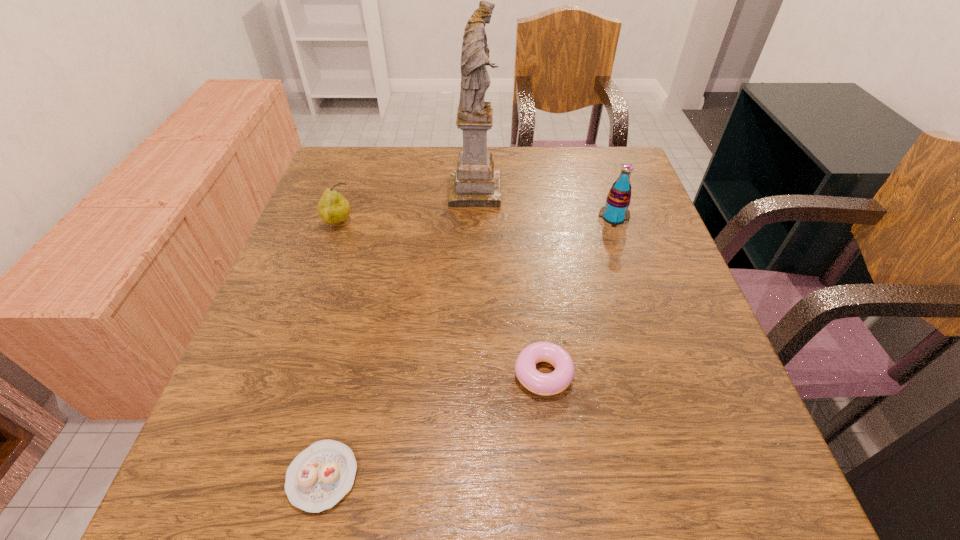
Locate an element on the screen. The height and width of the screenshot is (540, 960). object that is positioned at the near left corner is located at coordinates (320, 476).

This screenshot has width=960, height=540. In the image, there is a desktop. Identify the location of vacant space at the far edge. (396, 173).

What are the coordinates of `vacant region at the near edge of the desktop` in the screenshot? It's located at (464, 484).

I want to click on blank area at the left edge, so click(333, 321).

The height and width of the screenshot is (540, 960). I want to click on vacant region at the right edge of the desktop, so click(x=664, y=306).

You are a GUI agent. You are given a task and a screenshot of the screen. Output one action in this format:
    pyautogui.click(x=<x>, y=<y>)
    Task: Click on the vacant space at the far right corner of the desktop
    This screenshot has height=540, width=960.
    Given the screenshot: What is the action you would take?
    pyautogui.click(x=614, y=151)

This screenshot has width=960, height=540. I want to click on vacant region at the near right corner of the desktop, so click(x=663, y=461).

Image resolution: width=960 pixels, height=540 pixels. I want to click on vacant area between the doughnut and the soda, so coord(578,295).

Locate an element on the screen. This screenshot has width=960, height=540. blank region between the fourth shortest object and the cupcake is located at coordinates (468, 347).

Find the location of a particular element. free space between the second object from left to right and the tallest object is located at coordinates (398, 334).